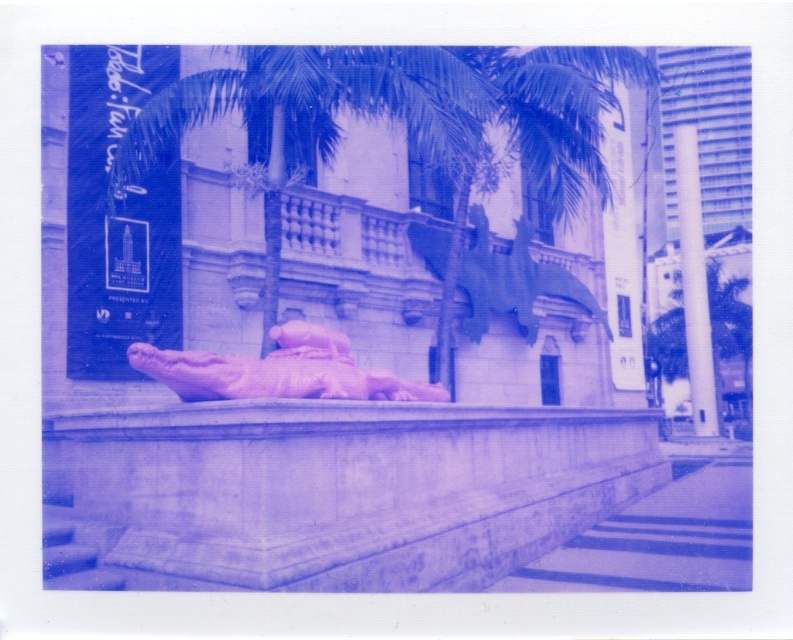
Question: Estimate the real-world distances between objects in this image. Which object is closer to the green leafy palm tree at center?

Choices:
 (A) pink rubber statue at center
 (B) white glossy pillar at right
 (C) purple glossy statue at center
 (D) green leafy palm tree at right

Answer: (C)

Question: Is green leafy palm tree at center below pink rubber statue at center?

Choices:
 (A) no
 (B) yes

Answer: (A)

Question: Does smooth stone ledge at center have a smaller size compared to white glossy pillar at right?

Choices:
 (A) yes
 (B) no

Answer: (A)

Question: Is the position of smooth stone ledge at center less distant than that of green leafy palm tree at right?

Choices:
 (A) yes
 (B) no

Answer: (A)

Question: Which of the following is the closest to the observer?

Choices:
 (A) (661, 323)
 (B) (309, 355)

Answer: (B)

Question: Which point appears closest to the camera in this image?

Choices:
 (A) (73, 529)
 (B) (257, 128)
 (C) (715, 372)
 (D) (377, 376)

Answer: (A)